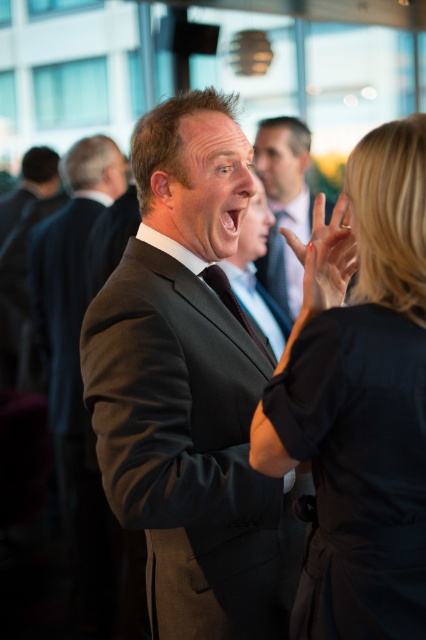
Question: Which object is positioned closest to the black matte dress at center?

Choices:
 (A) dark gray suit at center
 (B) smooth skin hand at center

Answer: (B)

Question: Is black matte dress at center above matte black suit at center?

Choices:
 (A) no
 (B) yes

Answer: (A)

Question: Does matte black suit at center appear on the right side of smooth skin hand at center?

Choices:
 (A) no
 (B) yes

Answer: (B)

Question: Can you confirm if matte black suit at center is smaller than smooth skin hand at center?

Choices:
 (A) yes
 (B) no

Answer: (B)

Question: Which is nearer to the matte black suit at center?

Choices:
 (A) black matte dress at center
 (B) smooth skin hand at center
 (C) dark gray suit at center

Answer: (B)

Question: Which object is the closest to the dark gray suit at center?

Choices:
 (A) black matte dress at center
 (B) matte black suit at center

Answer: (A)